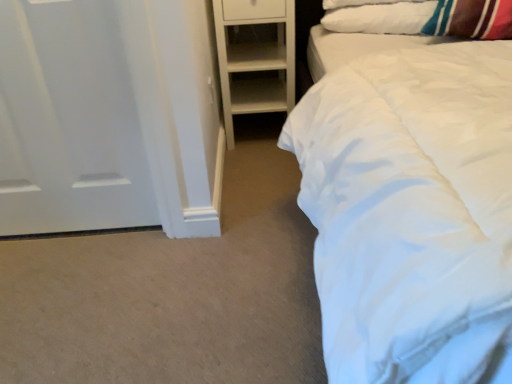
Question: Is white soft pillow at upper right surrounded by white matte door at left?

Choices:
 (A) yes
 (B) no

Answer: (B)

Question: Does white matte door at left have a larger size compared to white soft pillow at upper right?

Choices:
 (A) yes
 (B) no

Answer: (A)

Question: Is the position of white matte door at left less distant than that of white soft pillow at upper right?

Choices:
 (A) yes
 (B) no

Answer: (A)

Question: Can you confirm if white matte door at left is smaller than white soft pillow at upper right?

Choices:
 (A) no
 (B) yes

Answer: (A)

Question: From a real-world perspective, is white matte door at left located beneath white soft pillow at upper right?

Choices:
 (A) yes
 (B) no

Answer: (A)

Question: Can you confirm if white matte door at left is wider than white soft pillow at upper right?

Choices:
 (A) no
 (B) yes

Answer: (A)

Question: From a real-world perspective, is white soft pillow at upper right located higher than white matte wooden shelf at center?

Choices:
 (A) no
 (B) yes

Answer: (B)

Question: Does white soft pillow at upper right come in front of white matte wooden shelf at center?

Choices:
 (A) yes
 (B) no

Answer: (A)

Question: Considering the relative sizes of white soft pillow at upper right and white matte wooden shelf at center in the image provided, is white soft pillow at upper right shorter than white matte wooden shelf at center?

Choices:
 (A) yes
 (B) no

Answer: (A)

Question: Considering the relative positions of white soft pillow at upper right and white matte wooden shelf at center in the image provided, is white soft pillow at upper right to the left of white matte wooden shelf at center from the viewer's perspective?

Choices:
 (A) yes
 (B) no

Answer: (B)

Question: Is white soft pillow at upper right to the right of white matte wooden shelf at center from the viewer's perspective?

Choices:
 (A) yes
 (B) no

Answer: (A)

Question: From the image's perspective, is white soft pillow at upper right under white matte wooden shelf at center?

Choices:
 (A) yes
 (B) no

Answer: (B)

Question: Is white soft pillow at upper right placed right next to white matte door at left?

Choices:
 (A) yes
 (B) no

Answer: (B)